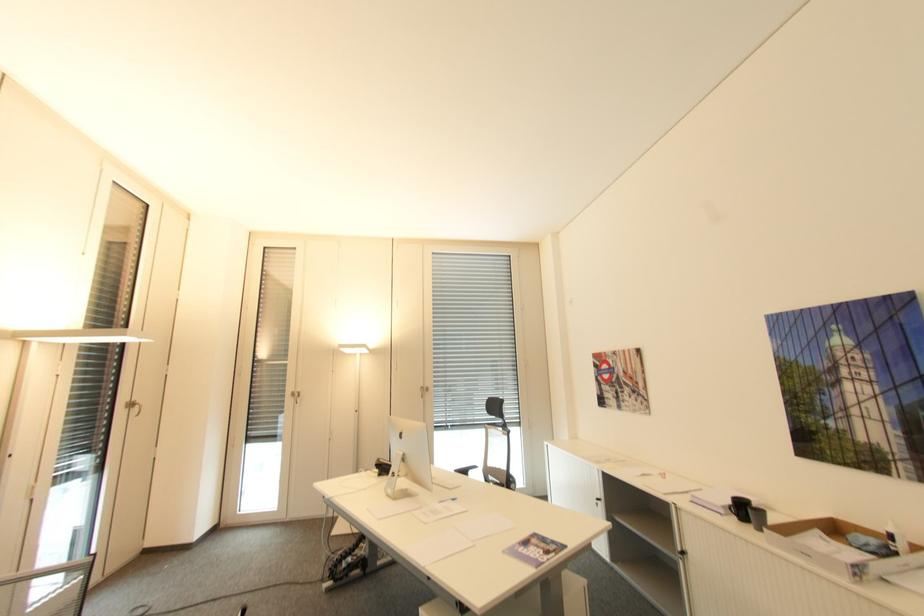
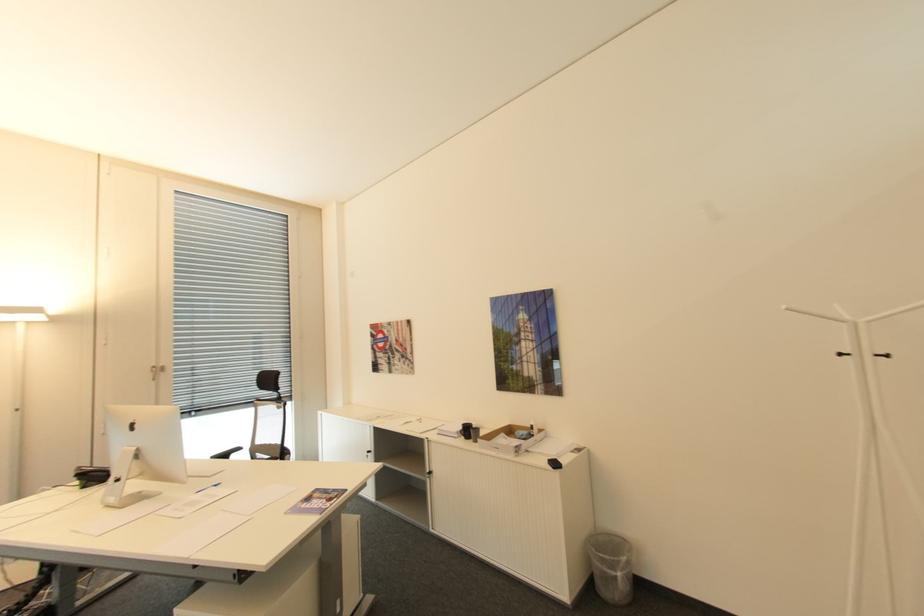
In the second image, find the point that corresponds to the point at 493,464 in the first image.

(261, 442)